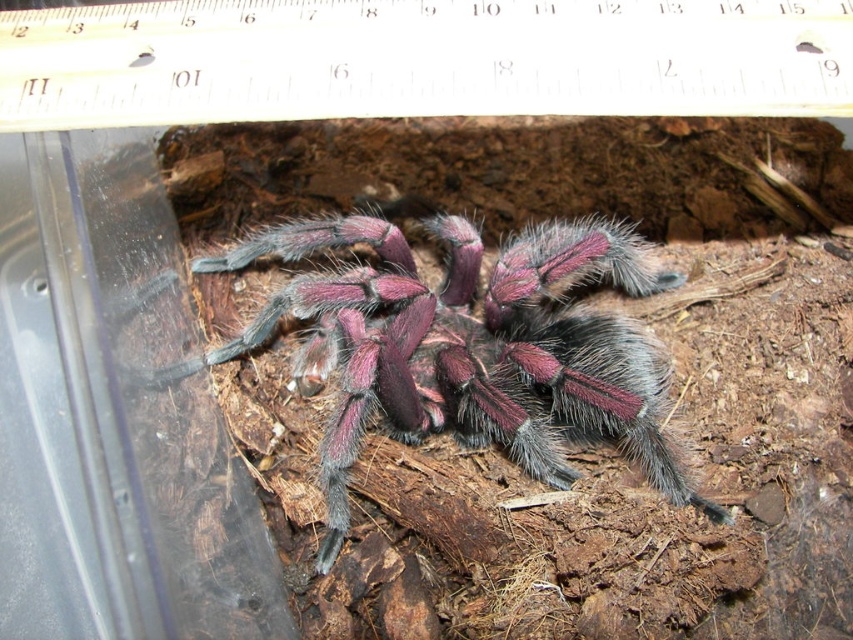
Question: Is white plastic ruler at upper center smaller than fuzzy purple spider at center?

Choices:
 (A) yes
 (B) no

Answer: (A)

Question: Does white plastic ruler at upper center come in front of fuzzy purple spider at center?

Choices:
 (A) no
 (B) yes

Answer: (B)

Question: Is white plastic ruler at upper center further to the viewer compared to fuzzy purple spider at center?

Choices:
 (A) yes
 (B) no

Answer: (B)